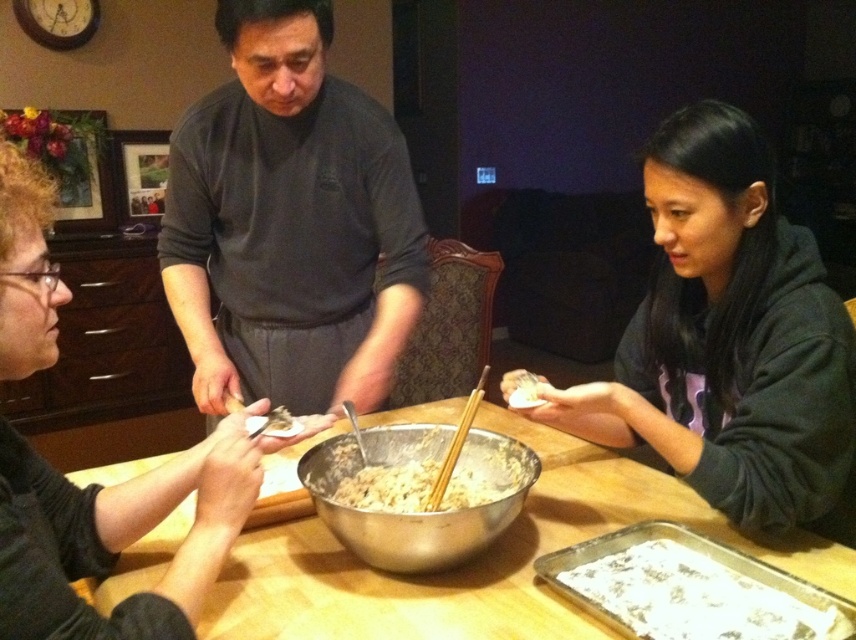
Question: Which is nearer to the metallic silver bowl at center?

Choices:
 (A) curly hair person at left
 (B) dark gray sweater at center
 (C) wooden table at center
 (D) brown wooden chopsticks at center

Answer: (D)

Question: Among these points, which one is nearest to the camera?

Choices:
 (A) (187, 179)
 (B) (462, 435)
 (C) (740, 113)
 (D) (418, 531)

Answer: (D)

Question: Can you confirm if wooden table at center is smaller than metallic silver bowl at center?

Choices:
 (A) no
 (B) yes

Answer: (A)

Question: Among these points, which one is farthest from the camera?

Choices:
 (A) pyautogui.click(x=428, y=545)
 (B) pyautogui.click(x=447, y=468)
 (C) pyautogui.click(x=336, y=604)
 (D) pyautogui.click(x=666, y=416)

Answer: (D)

Question: In this image, where is curly hair person at left located relative to metallic silver bowl at center?

Choices:
 (A) right
 (B) left

Answer: (B)

Question: Observing the image, what is the correct spatial positioning of black hoodie at center in reference to wooden table at center?

Choices:
 (A) below
 (B) above

Answer: (B)